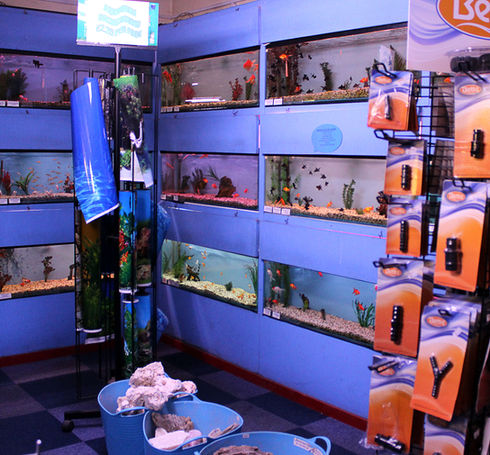
Find the location of a particular element. The width and height of the screenshot is (490, 455). fish tank is located at coordinates (314, 292), (214, 272), (49, 261), (329, 174), (211, 189), (30, 172), (320, 51), (206, 77), (37, 78).